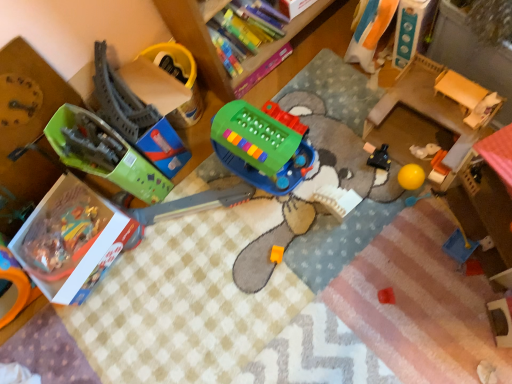
Find the location of a particular element. vacant space positioned to the left of orange fabric doll at upper right, the fourth toy when ordered from left to right is located at coordinates (324, 83).